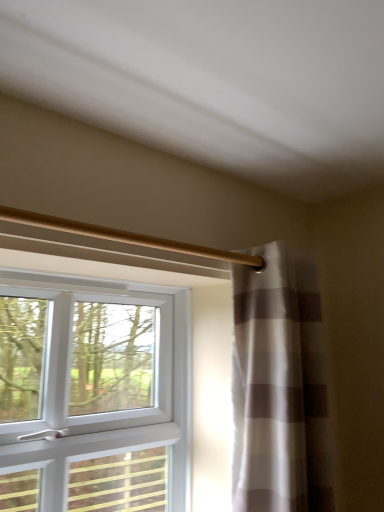
Question: From a real-world perspective, is white striped curtain at right physically located above or below gold metallic curtain rod at upper center?

Choices:
 (A) below
 (B) above

Answer: (A)

Question: Does point (241, 437) appear closer or farther from the camera than point (46, 217)?

Choices:
 (A) farther
 (B) closer

Answer: (A)

Question: Based on their relative distances, which object is farther from the white plastic window at left?

Choices:
 (A) gold metallic curtain rod at upper center
 (B) white striped curtain at right

Answer: (A)

Question: Considering the real-world distances, which object is closest to the gold metallic curtain rod at upper center?

Choices:
 (A) white striped curtain at right
 (B) white plastic window at left

Answer: (A)